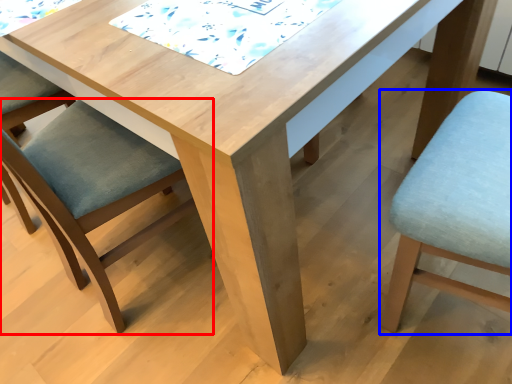
Question: Which object appears closest to the camera in this image, chair (highlighted by a red box) or chair (highlighted by a blue box)?

Choices:
 (A) chair
 (B) chair

Answer: (B)